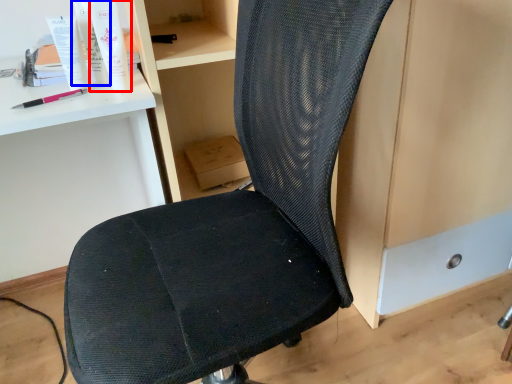
Question: Which of the following is the closest to the observer, toiletry (highlighted by a red box) or toiletry (highlighted by a blue box)?

Choices:
 (A) toiletry
 (B) toiletry

Answer: (A)